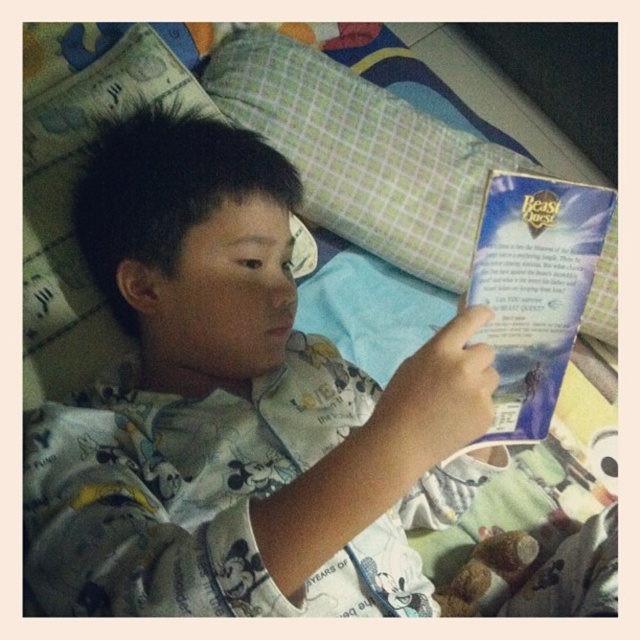
Question: Does white cotton pajamas at center appear on the left side of blue paper at upper right?

Choices:
 (A) yes
 (B) no

Answer: (A)

Question: Which of these objects is positioned farthest from the green checkered pillow at upper center?

Choices:
 (A) white cotton pajamas at center
 (B) blue paper at upper right

Answer: (B)

Question: Which point is closer to the camera taking this photo?

Choices:
 (A) (584, 275)
 (B) (326, 360)
 (C) (468, 163)

Answer: (A)

Question: Considering the relative positions of white cotton pajamas at center and green checkered pillow at upper center in the image provided, where is white cotton pajamas at center located with respect to green checkered pillow at upper center?

Choices:
 (A) left
 (B) right

Answer: (A)

Question: Considering the real-world distances, which object is closest to the green checkered pillow at upper center?

Choices:
 (A) white cotton pajamas at center
 (B) blue paper at upper right

Answer: (A)

Question: Is white cotton pajamas at center to the left of green checkered pillow at upper center from the viewer's perspective?

Choices:
 (A) no
 (B) yes

Answer: (B)